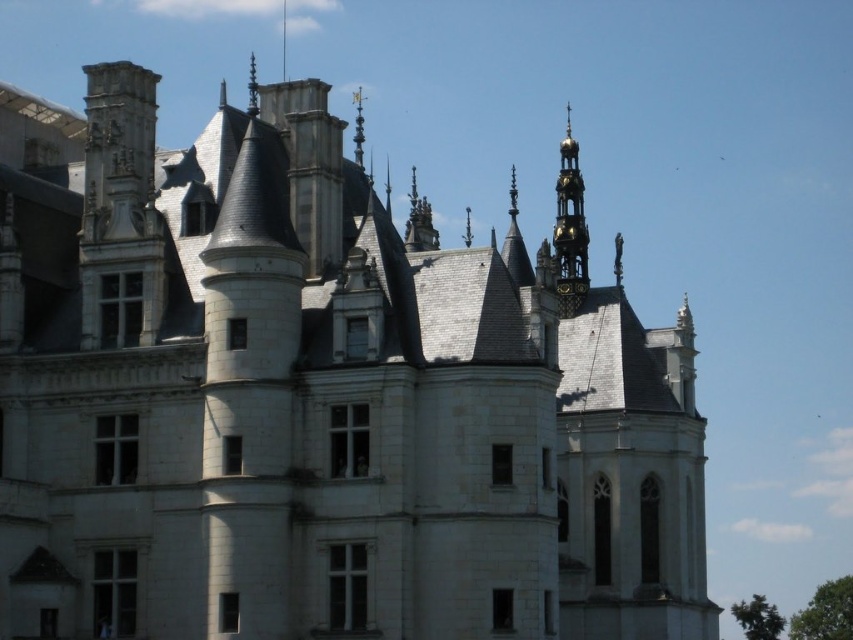
Question: Which object is closer to the camera taking this photo?

Choices:
 (A) gold plated spire at upper right
 (B) gold polished spire at upper center
 (C) gold metallic spire at upper center

Answer: (A)

Question: In this image, where is gold plated spire at upper right located relative to gold metallic spire at upper center?

Choices:
 (A) left
 (B) right

Answer: (B)

Question: In this image, where is gold plated spire at upper right located relative to gold polished spire at upper center?

Choices:
 (A) right
 (B) left

Answer: (A)

Question: Considering the real-world distances, which object is closest to the gold metallic spire at upper center?

Choices:
 (A) gold polished spire at upper center
 (B) gold plated spire at upper right

Answer: (A)

Question: Does gold polished spire at upper center have a larger size compared to gold metallic spire at upper center?

Choices:
 (A) yes
 (B) no

Answer: (B)

Question: Among these points, which one is farthest from the camera?

Choices:
 (A) click(363, 134)
 (B) click(556, 266)
 (C) click(247, 108)

Answer: (B)